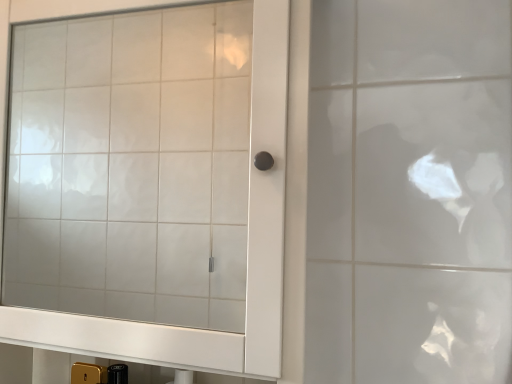
Find the location of a particular element. satin white mirror at center is located at coordinates (132, 166).

What do you see at coordinates (132, 166) in the screenshot? I see `satin white mirror at center` at bounding box center [132, 166].

Find the location of `satin white mirror at center`. satin white mirror at center is located at coordinates (132, 166).